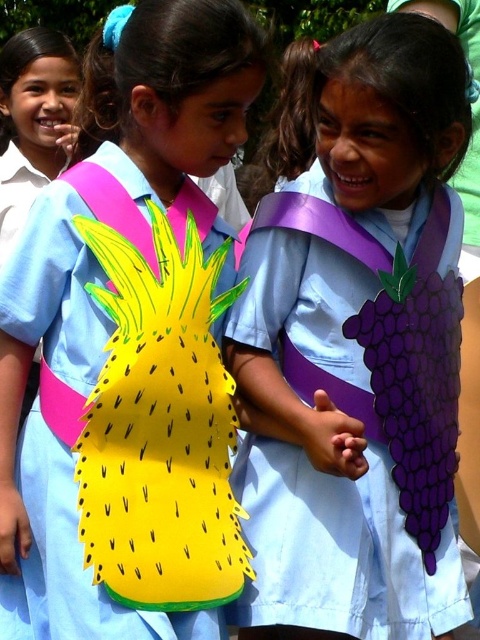
You are standing in front of the yellow paper pineapple at center and want to reach out to touch it. If your arm can extend 1.5 meters, can you reach it?

The yellow paper pineapple at center is 2.77 meters away from the viewer, so your arm can only extend 1.5 meters, meaning you cannot reach it.